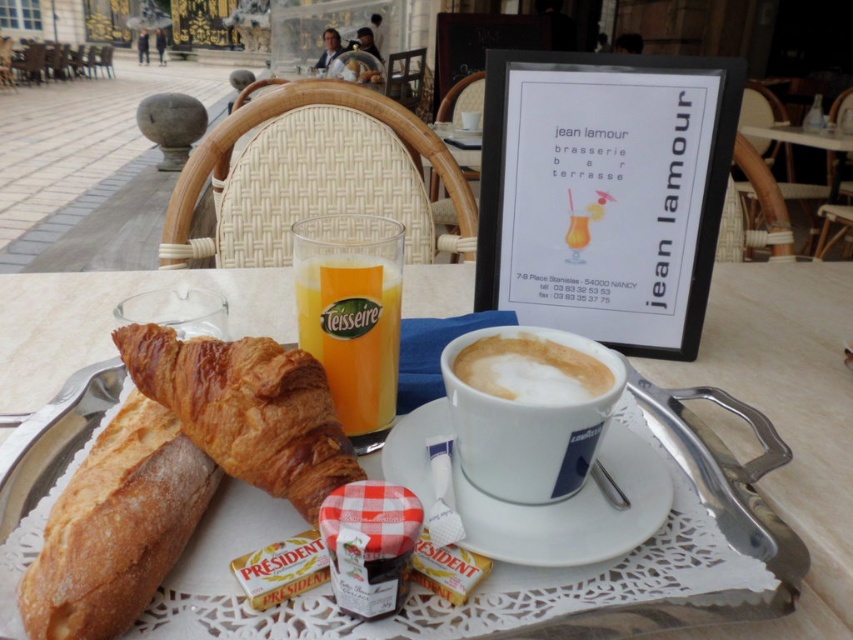
Does point (785, 408) come farther from viewer compared to point (287, 394)?

Yes.

Who is positioned more to the right, white porcelain tray at center or golden brown flaky croissant at center?

white porcelain tray at center

Is point (48, 364) positioned in front of point (316, 464)?

No, it is behind (316, 464).

The width and height of the screenshot is (853, 640). In order to click on white porcelain tray at center in this screenshot , I will do `click(788, 419)`.

Is golden brown flaky croissant at center wider than white frothy coffee cup at center?

Indeed, golden brown flaky croissant at center has a greater width compared to white frothy coffee cup at center.

At what (x,y) coordinates should I click in order to perform the action: click on golden brown flaky croissant at center. Please return your answer as a coordinate pair (x, y). The width and height of the screenshot is (853, 640). Looking at the image, I should click on (247, 410).

Can you confirm if orangematte glass at center is bigger than white frothy coffee cup at center?

Correct, orangematte glass at center is larger in size than white frothy coffee cup at center.

Which is behind, point (341, 289) or point (511, 348)?

The point (511, 348) is behind.

You are a GUI agent. You are given a task and a screenshot of the screen. Output one action in this format:
    pyautogui.click(x=<x>, y=<y>)
    Task: Click on the orangematte glass at center
    This screenshot has height=640, width=853.
    Given the screenshot: What is the action you would take?
    pyautogui.click(x=352, y=333)